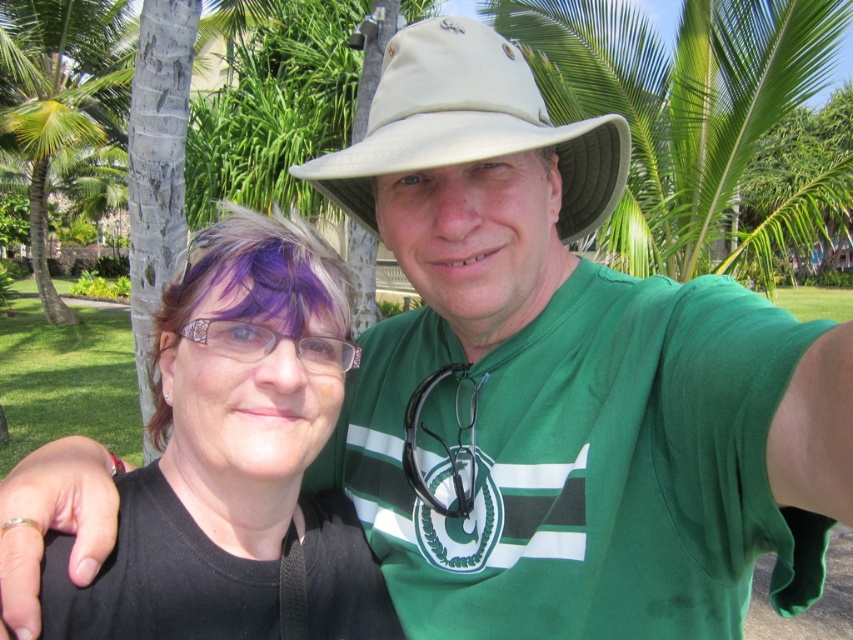
Consider the image. You are taking a photo of the scene described. The black matte hair at center and the green leafy palm tree at upper left are both in your view. Based on their positions, which object is closer to the left side of your camera frame?

The green leafy palm tree at upper left is closer to the left side of your camera frame because the black matte hair at center is to the right of it.

You are a photographer trying to focus on the black matte hair at center and the beige fabric hat at center in the image. Which object should you adjust your camera focus on first to ensure proper depth of field?

The black matte hair at center is closer to the viewer than the beige fabric hat at center, so you should focus on the black matte hair at center first to ensure proper depth of field.

You are a photographer trying to adjust the lighting for a portrait. You notice the black matte hair at center and the purple dyed hair at left in the scene. Based on their positions, which hair color might be more shadowed by the other?

The black matte hair at center is below the purple dyed hair at left, so the purple dyed hair at left could cast a shadow over the black matte hair at center depending on the light direction.